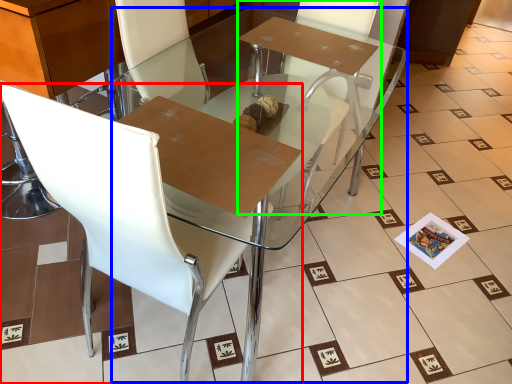
Question: Based on their relative distances, which object is nearer to chair (highlighted by a red box)? Choose from round table (highlighted by a blue box) and armchair (highlighted by a green box).

Choices:
 (A) round table
 (B) armchair

Answer: (A)